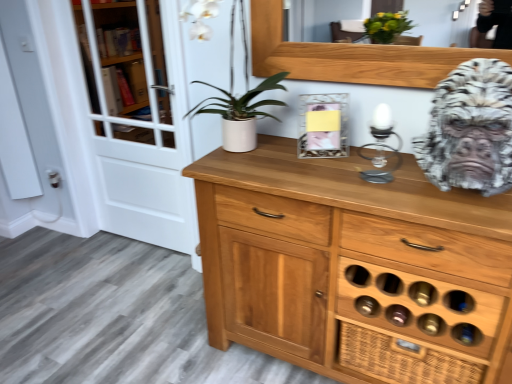
Question: Considering the relative sizes of white marble gorilla head at right and white matte pot at center in the image provided, is white marble gorilla head at right thinner than white matte pot at center?

Choices:
 (A) no
 (B) yes

Answer: (A)

Question: From a real-world perspective, is white marble gorilla head at right physically above white matte pot at center?

Choices:
 (A) yes
 (B) no

Answer: (B)

Question: Can you confirm if white marble gorilla head at right is shorter than white matte pot at center?

Choices:
 (A) no
 (B) yes

Answer: (B)

Question: Would you say white marble gorilla head at right is outside white matte pot at center?

Choices:
 (A) no
 (B) yes

Answer: (B)

Question: Could you tell me if white marble gorilla head at right is turned towards white matte pot at center?

Choices:
 (A) no
 (B) yes

Answer: (A)

Question: From the image's perspective, is white glass screen door at left located above or below clear glass candle holder at center?

Choices:
 (A) above
 (B) below

Answer: (A)

Question: Is point (101, 104) closer or farther from the camera than point (370, 173)?

Choices:
 (A) closer
 (B) farther

Answer: (B)

Question: Based on their sizes in the image, would you say white glass screen door at left is bigger or smaller than clear glass candle holder at center?

Choices:
 (A) big
 (B) small

Answer: (A)

Question: From a real-world perspective, is white glass screen door at left positioned above or below clear glass candle holder at center?

Choices:
 (A) below
 (B) above

Answer: (A)

Question: Looking at their shapes, would you say white glass screen door at left is wider or thinner than white matte pot at center?

Choices:
 (A) wide
 (B) thin

Answer: (B)

Question: From the image's perspective, is white glass screen door at left above or below white matte pot at center?

Choices:
 (A) below
 (B) above

Answer: (A)

Question: Considering the relative positions of white glass screen door at left and white matte pot at center in the image provided, is white glass screen door at left to the left or to the right of white matte pot at center?

Choices:
 (A) left
 (B) right

Answer: (A)

Question: Is point (154, 205) positioned closer to the camera than point (242, 99)?

Choices:
 (A) closer
 (B) farther

Answer: (B)

Question: From a real-world perspective, is clear glass candle holder at center physically located above or below white glass screen door at left?

Choices:
 (A) below
 (B) above

Answer: (B)

Question: From the image's perspective, is clear glass candle holder at center located above or below white glass screen door at left?

Choices:
 (A) above
 (B) below

Answer: (B)